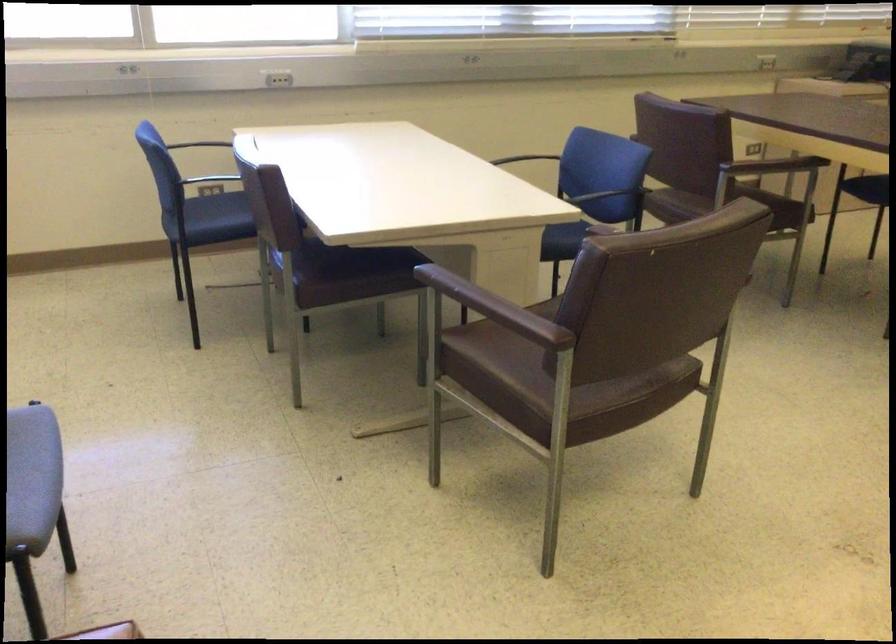
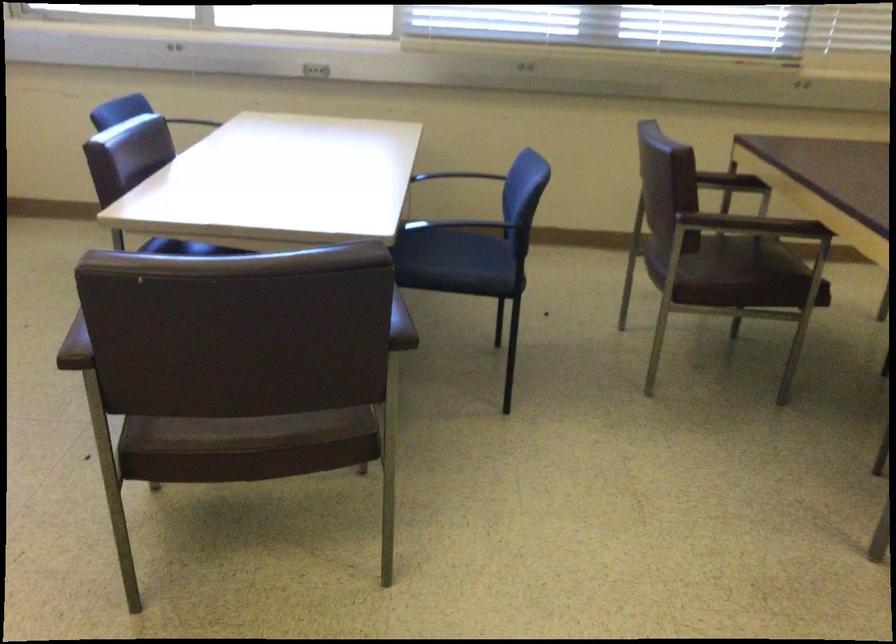
Consider the image. The images are taken continuously from a first-person perspective. In which direction are you moving?

The cameraman moved toward right, forward.